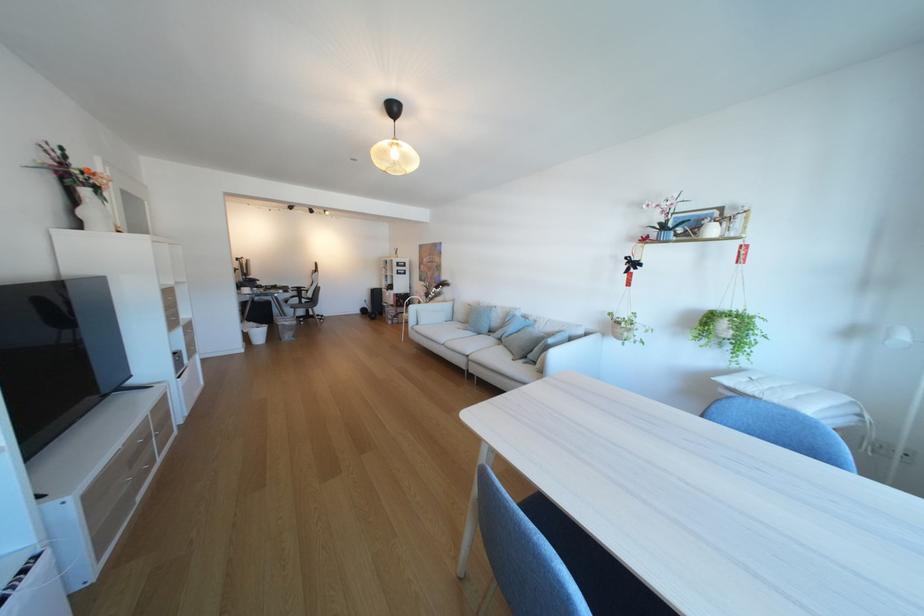
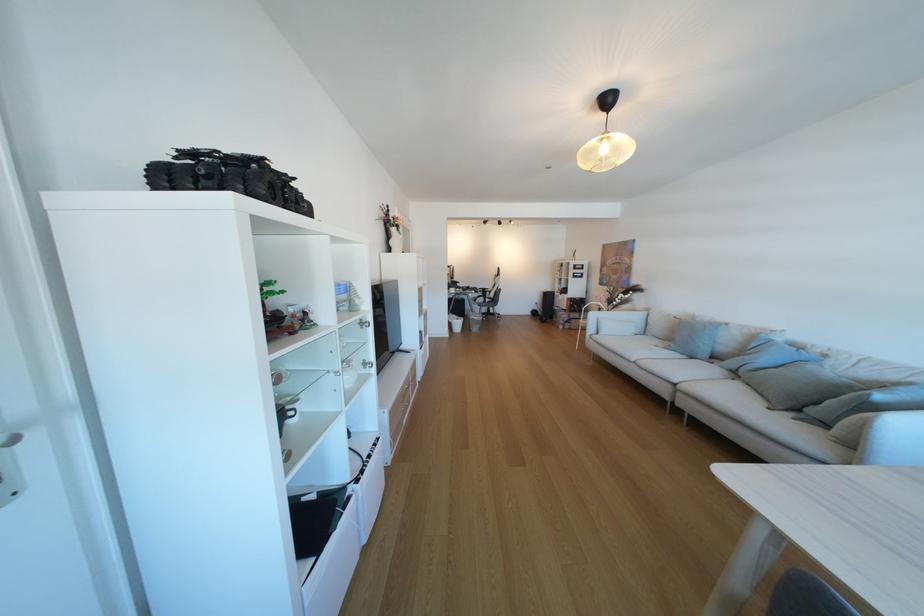
The point at (500, 336) is marked in the first image. Where is the corresponding point in the second image?

(723, 363)